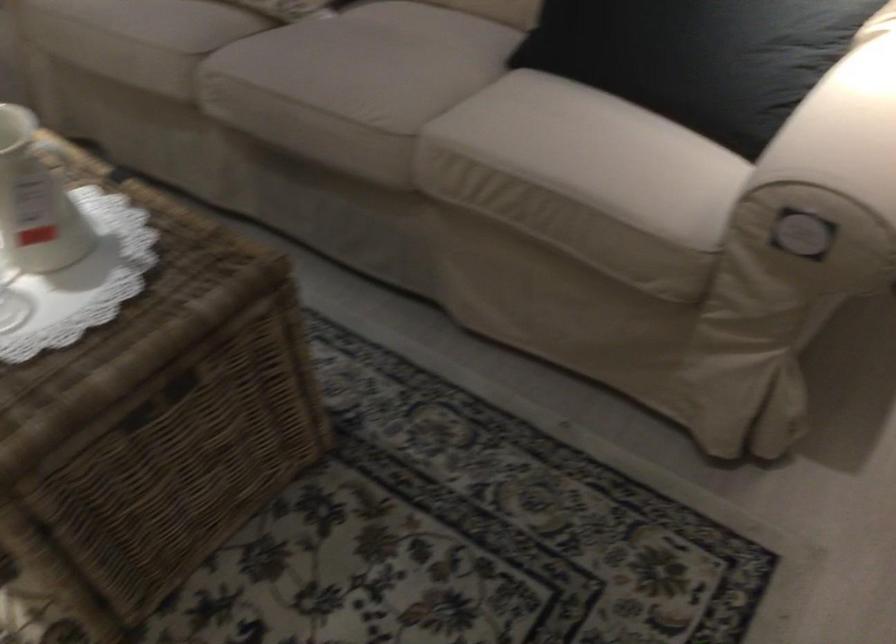
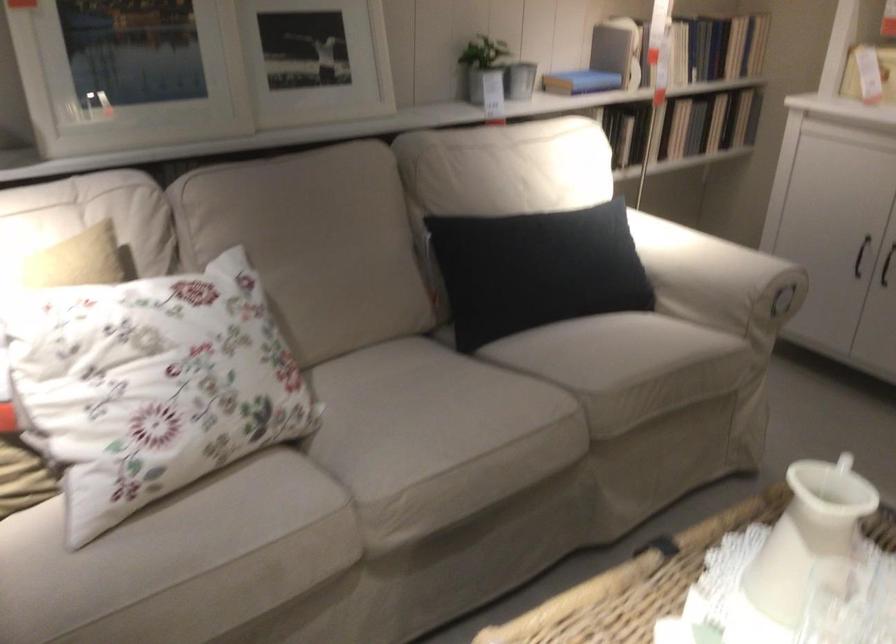
Find the pixel in the second image that matches [238,80] in the first image.

(398, 494)